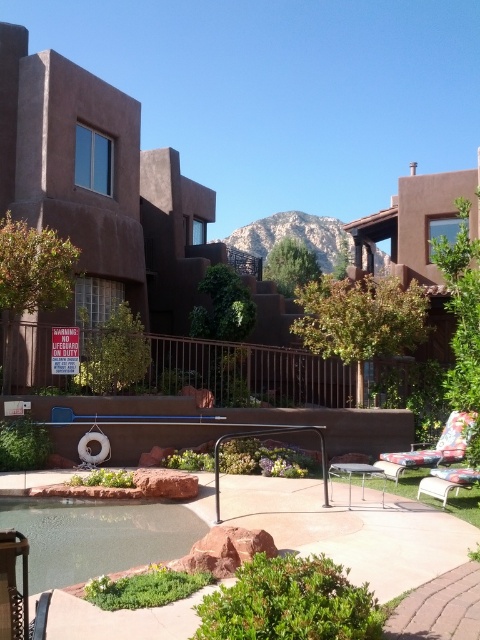
You are a guest at this resort and want to place your beach umbrella between the clear glass pool at center and the white plastic chair at lower right. Considering their sizes, will the umbrella fit comfortably between them without touching either?

The clear glass pool at center is wider than the white plastic chair at lower right. Since the pool is wider, there should be enough space between them to place the beach umbrella comfortably without it touching either object.

You are a guest staying at this resort and want to take a photo of the clear glass pool at center from the floral fabric lounge chair at lower right. Can you see the entire pool from that position?

The clear glass pool at center is in front of the floral fabric lounge chair at lower right, so yes, you can see the entire pool from that position.